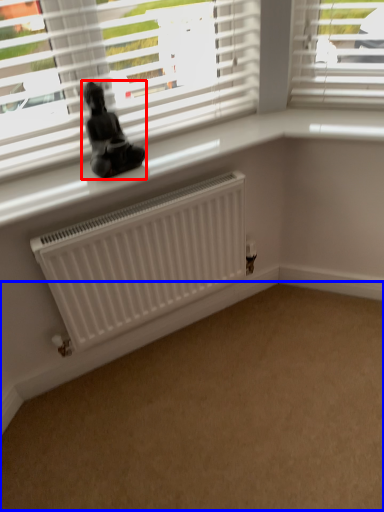
Question: Which object appears farthest to the camera in this image, miniature (highlighted by a red box) or plain (highlighted by a blue box)?

Choices:
 (A) miniature
 (B) plain

Answer: (A)